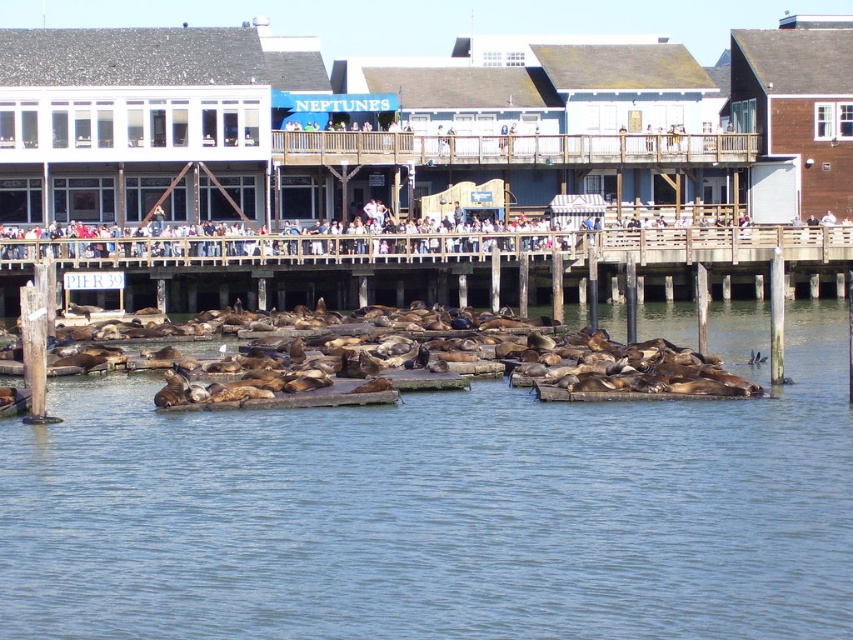
Question: Does clear blue water at center appear on the right side of light brown wooden pier at center?

Choices:
 (A) no
 (B) yes

Answer: (B)

Question: Which of these objects is positioned farthest from the brown wooden dock at center?

Choices:
 (A) brown fur seal at lower center
 (B) clear blue water at center
 (C) light brown wooden pier at center

Answer: (B)

Question: Does brown wooden dock at center have a smaller size compared to brown fur seal at lower center?

Choices:
 (A) yes
 (B) no

Answer: (A)

Question: Which object appears closest to the camera in this image?

Choices:
 (A) brown wooden dock at center
 (B) brown fur seal at lower center
 (C) light brown wooden pier at center

Answer: (B)

Question: Does clear blue water at center have a greater width compared to light brown wooden pier at center?

Choices:
 (A) yes
 (B) no

Answer: (B)

Question: Which object is the farthest from the brown wooden dock at center?

Choices:
 (A) light brown wooden pier at center
 (B) brown fur seal at lower center
 (C) clear blue water at center

Answer: (C)